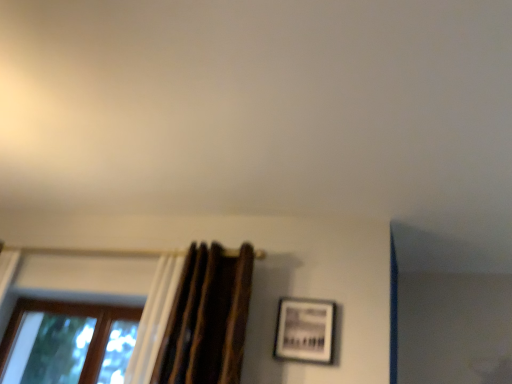
Question: Considering the relative positions of matte black picture frame at center-right and brown textured curtain at left in the image provided, is matte black picture frame at center-right in front of brown textured curtain at left?

Choices:
 (A) no
 (B) yes

Answer: (A)

Question: Is matte black picture frame at center-right shorter than brown textured curtain at left?

Choices:
 (A) yes
 (B) no

Answer: (A)

Question: From the image's perspective, would you say matte black picture frame at center-right is shown under brown textured curtain at left?

Choices:
 (A) yes
 (B) no

Answer: (A)

Question: Would you say matte black picture frame at center-right is a long distance from brown textured curtain at left?

Choices:
 (A) no
 (B) yes

Answer: (A)

Question: Is matte black picture frame at center-right not within brown textured curtain at left?

Choices:
 (A) yes
 (B) no

Answer: (A)

Question: In the image, is matte black picture frame at center-right positioned in front of or behind brown wooden window at lower left?

Choices:
 (A) front
 (B) behind

Answer: (A)

Question: In terms of height, does matte black picture frame at center-right look taller or shorter compared to brown wooden window at lower left?

Choices:
 (A) short
 (B) tall

Answer: (A)

Question: From the image's perspective, is matte black picture frame at center-right positioned above or below brown wooden window at lower left?

Choices:
 (A) below
 (B) above

Answer: (B)

Question: Is matte black picture frame at center-right spatially inside brown wooden window at lower left, or outside of it?

Choices:
 (A) outside
 (B) inside

Answer: (A)

Question: Based on their positions, is brown textured curtain at left located to the left or right of matte black picture frame at center-right?

Choices:
 (A) left
 (B) right

Answer: (A)

Question: Relative to matte black picture frame at center-right, is brown textured curtain at left in front or behind?

Choices:
 (A) behind
 (B) front

Answer: (B)

Question: Based on their sizes in the image, would you say brown textured curtain at left is bigger or smaller than matte black picture frame at center-right?

Choices:
 (A) big
 (B) small

Answer: (A)

Question: From the image's perspective, is brown textured curtain at left above or below matte black picture frame at center-right?

Choices:
 (A) above
 (B) below

Answer: (A)

Question: From the image's perspective, is matte black picture frame at center-right above or below brown textured curtain at left?

Choices:
 (A) below
 (B) above

Answer: (A)

Question: Considering the positions of matte black picture frame at center-right and brown textured curtain at left in the image, is matte black picture frame at center-right taller or shorter than brown textured curtain at left?

Choices:
 (A) tall
 (B) short

Answer: (B)